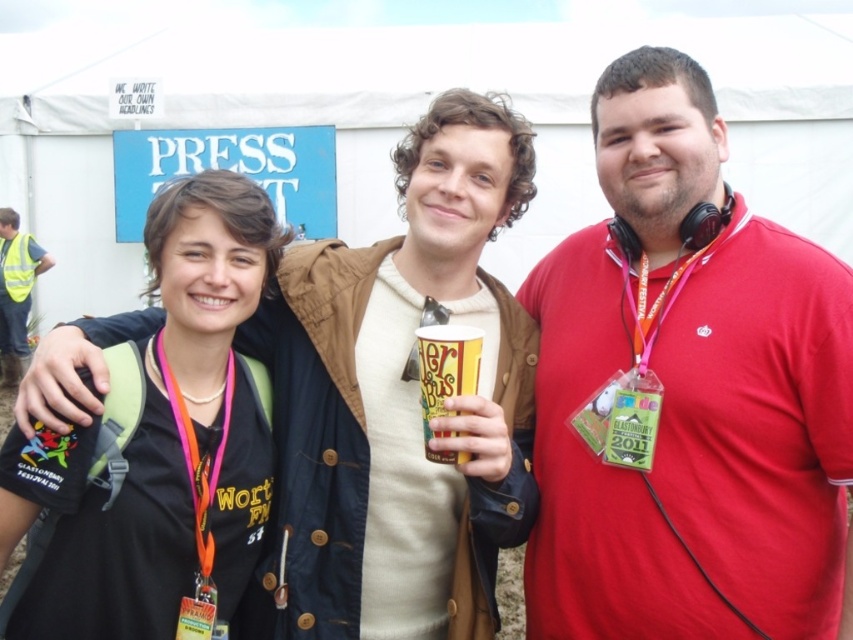
Looking at this image, you are at a festival and need to take a photo with the matte brown jacket at center and the yellow paper cup at center. Which object should you focus on first if you want to ensure both are in focus without moving the camera?

The matte brown jacket at center is taller than the yellow paper cup at center, so focusing on the matte brown jacket at center first will help ensure both are in focus since it is larger and closer to the camera.

You are at a festival and see two items at the center of the image. The red cotton shirt at center and the yellow paper cup at center. Which one is larger in size?

The red cotton shirt at center is bigger than the yellow paper cup at center.